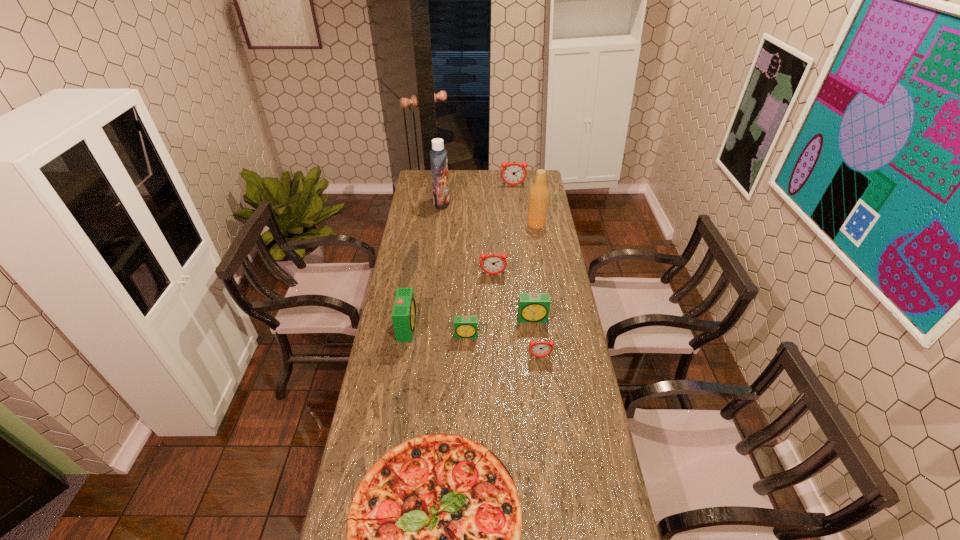
Where is `shampoo`? The width and height of the screenshot is (960, 540). shampoo is located at coordinates (438, 155).

You are a GUI agent. You are given a task and a screenshot of the screen. Output one action in this format:
    pyautogui.click(x=<x>, y=<y>)
    Task: Click on the second farthest object
    The width and height of the screenshot is (960, 540).
    Given the screenshot: What is the action you would take?
    pyautogui.click(x=438, y=155)

Identify the location of tan beer bottle. This screenshot has height=540, width=960. point(539,193).

You are a GUI agent. You are given a task and a screenshot of the screen. Output one action in this format:
    pyautogui.click(x=<x>, y=<y>)
    Task: Click on the second tallest object
    Image resolution: width=960 pixels, height=540 pixels.
    Given the screenshot: What is the action you would take?
    pyautogui.click(x=539, y=193)

I want to click on the farthest alarm clock, so pyautogui.click(x=513, y=173).

The image size is (960, 540). Identify the location of the farthest object. (513, 173).

Locate an element on the screen. The width and height of the screenshot is (960, 540). the leftmost alarm clock is located at coordinates (404, 314).

The image size is (960, 540). I want to click on the biggest green alarm clock, so click(404, 314).

The height and width of the screenshot is (540, 960). What are the coordinates of `the sixth nearest object` in the screenshot? It's located at (493, 263).

Locate an element on the screen. Image resolution: width=960 pixels, height=540 pixels. the second nearest reddish-pink alarm clock is located at coordinates (493, 263).